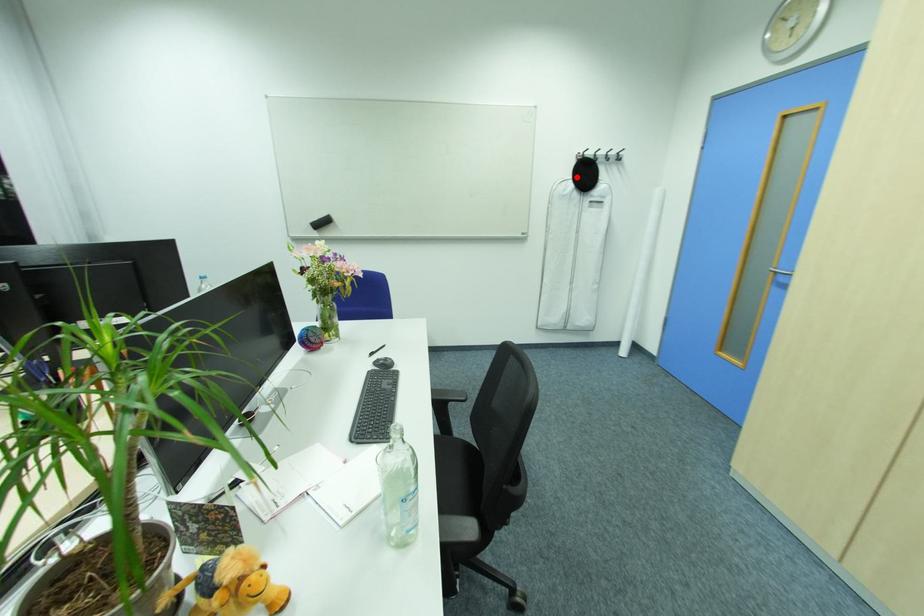
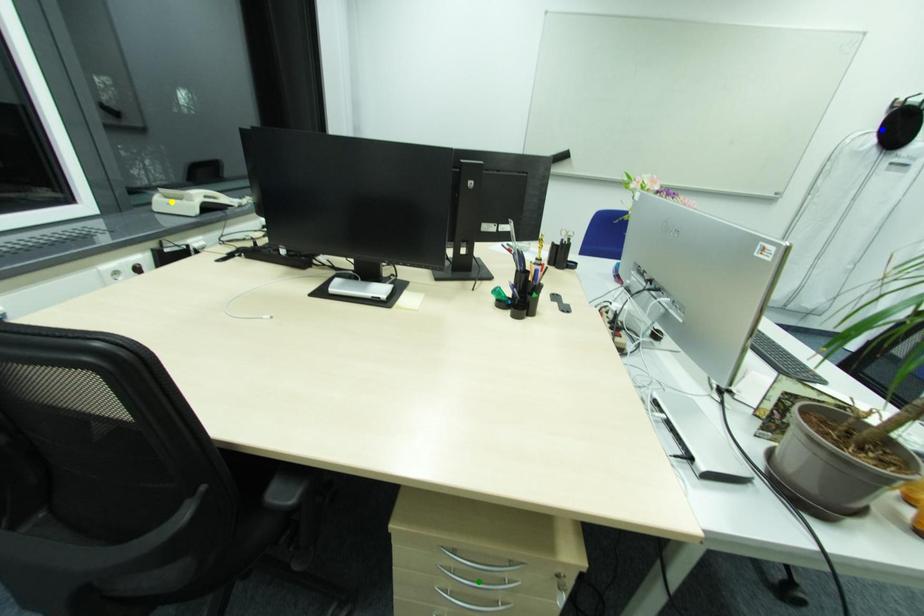
Question: I am providing you with two images of the same scene from different viewpoints. A red point is marked on the first image. You are given multiple points on the second image. In image 2, which mark is for the same physical point as the one in image 1?

Choices:
 (A) blue point
 (B) yellow point
 (C) green point

Answer: (A)